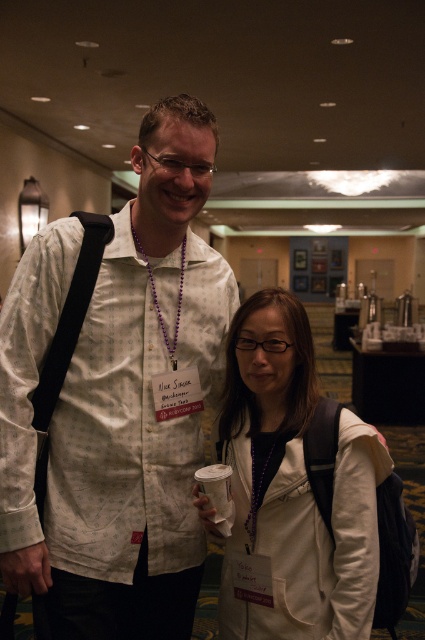
Does white printed shirt at center come behind white matte jacket at center?

Yes.

Does white printed shirt at center appear under white matte jacket at center?

Actually, white printed shirt at center is above white matte jacket at center.

Find the location of a particular element. white printed shirt at center is located at coordinates (115, 400).

At what (x,y) coordinates should I click in order to perform the action: click on white printed shirt at center. Please return your answer as a coordinate pair (x, y). Looking at the image, I should click on (115, 400).

Which is behind, point (65, 339) or point (186, 237)?

The point (186, 237) is more distant.

Does white printed shirt at center appear under purple beaded necklace at center?

Yes, white printed shirt at center is below purple beaded necklace at center.

Image resolution: width=425 pixels, height=640 pixels. I want to click on white printed shirt at center, so click(x=115, y=400).

Which is more to the left, white matte jacket at center or purple beaded necklace at center?

purple beaded necklace at center

Measure the distance between white matte jacket at center and purple beaded necklace at center.

white matte jacket at center is 39.30 centimeters away from purple beaded necklace at center.

This screenshot has width=425, height=640. Identify the location of white matte jacket at center. (291, 490).

Where is `white matte jacket at center`? The image size is (425, 640). white matte jacket at center is located at coordinates pyautogui.click(x=291, y=490).